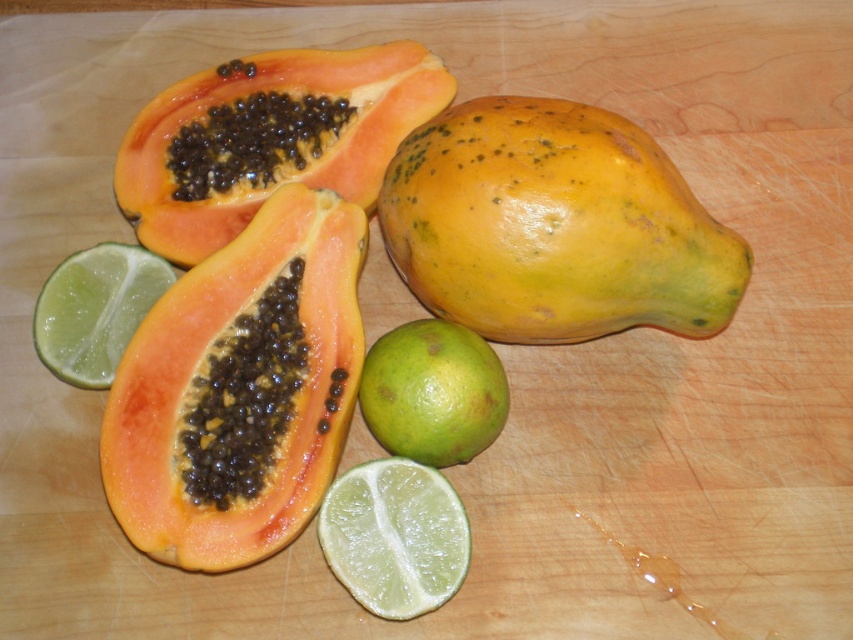
Between orange matte papaya at upper left and green matte lime at center, which one appears on the right side from the viewer's perspective?

green matte lime at center

Who is more forward, [322,83] or [448,420]?

Positioned in front is point [448,420].

This screenshot has width=853, height=640. What are the coordinates of `orange matte papaya at upper left` in the screenshot? It's located at click(268, 138).

Which of these two, green matte lime at center or green matte lemon at lower left, stands taller?

green matte lime at center

Consider the image. Which is more to the left, green matte lime at center or green matte lemon at lower left?

Positioned to the left is green matte lemon at lower left.

Which is in front, point (457, 440) or point (70, 320)?

Point (457, 440) is more forward.

Identify the location of green matte lime at center. This screenshot has height=640, width=853. (433, 392).

In the scene shown: Does orange matte papaya at upper left have a lesser width compared to green matte lemon at lower center?

No.

Is orange matte papaya at upper left closer to camera compared to green matte lemon at lower center?

That is False.

Locate an element on the screen. This screenshot has height=640, width=853. orange matte papaya at upper left is located at coordinates (268, 138).

Where is `orange matte papaya at upper left`? This screenshot has height=640, width=853. orange matte papaya at upper left is located at coordinates (268, 138).